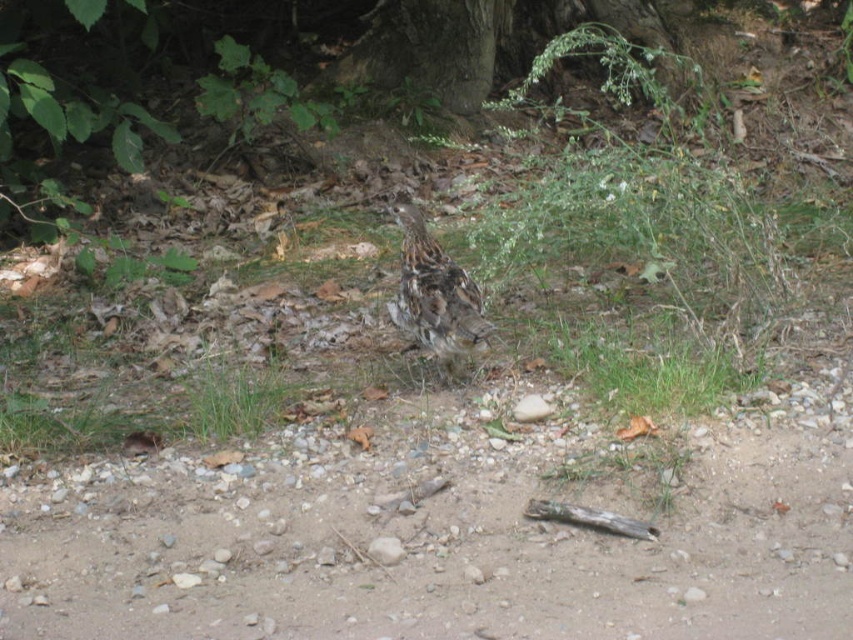
Question: Considering the relative positions of brown speckled bird at center and green soft grass at center in the image provided, where is brown speckled bird at center located with respect to green soft grass at center?

Choices:
 (A) below
 (B) above

Answer: (B)

Question: Which is farther from the green soft grass at center?

Choices:
 (A) brown speckled bird at center
 (B) smooth bark tree at upper center

Answer: (B)

Question: Which object is the closest to the smooth bark tree at upper center?

Choices:
 (A) brown speckled bird at center
 (B) green soft grass at center

Answer: (A)

Question: Which object is the farthest from the brown speckled bird at center?

Choices:
 (A) green soft grass at center
 (B) smooth bark tree at upper center

Answer: (B)

Question: From the image, what is the correct spatial relationship of smooth bark tree at upper center in relation to green soft grass at center?

Choices:
 (A) below
 (B) above

Answer: (B)

Question: Does brown speckled bird at center have a lesser width compared to green soft grass at center?

Choices:
 (A) yes
 (B) no

Answer: (A)